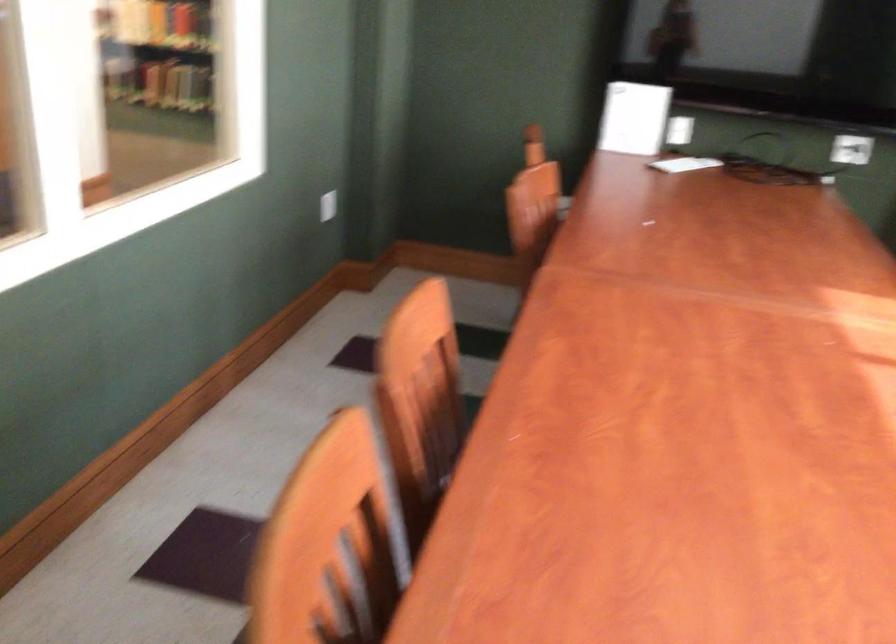
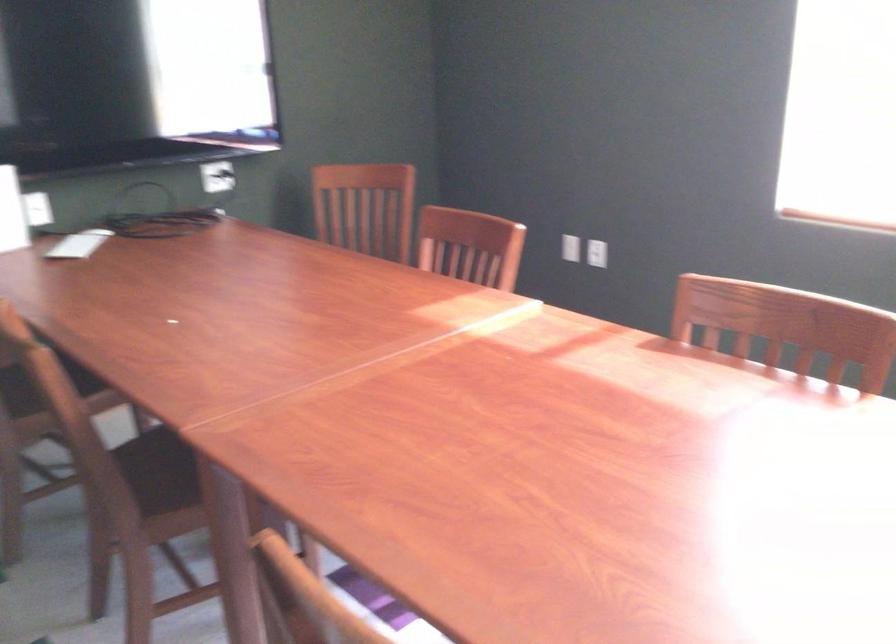
Question: The camera is either moving clockwise (left) or counter-clockwise (right) around the object. The first image is from the beginning of the video and the second image is from the end. Is the camera moving left or right when shooting the video?

Choices:
 (A) Left
 (B) Right

Answer: (A)